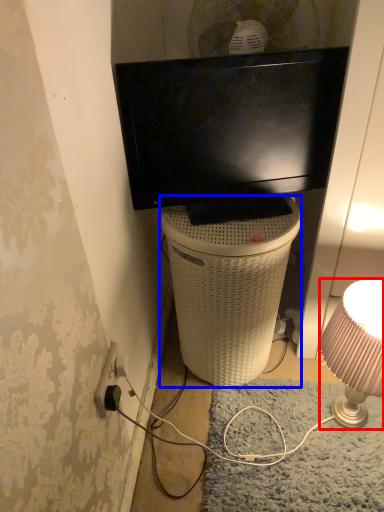
Question: Which point is further to the camera, lamp (highlighted by a red box) or trash bin/can (highlighted by a blue box)?

Choices:
 (A) lamp
 (B) trash bin/can

Answer: (B)